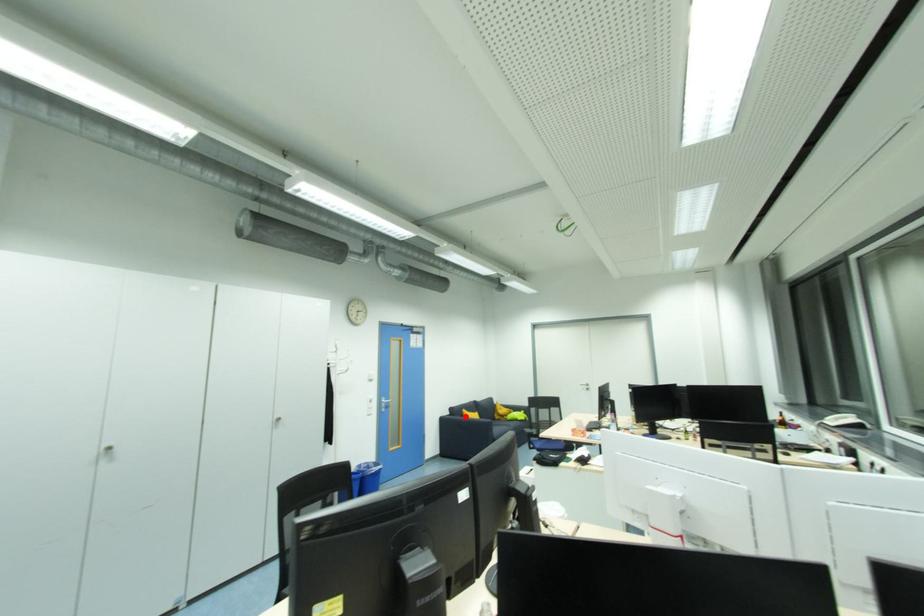
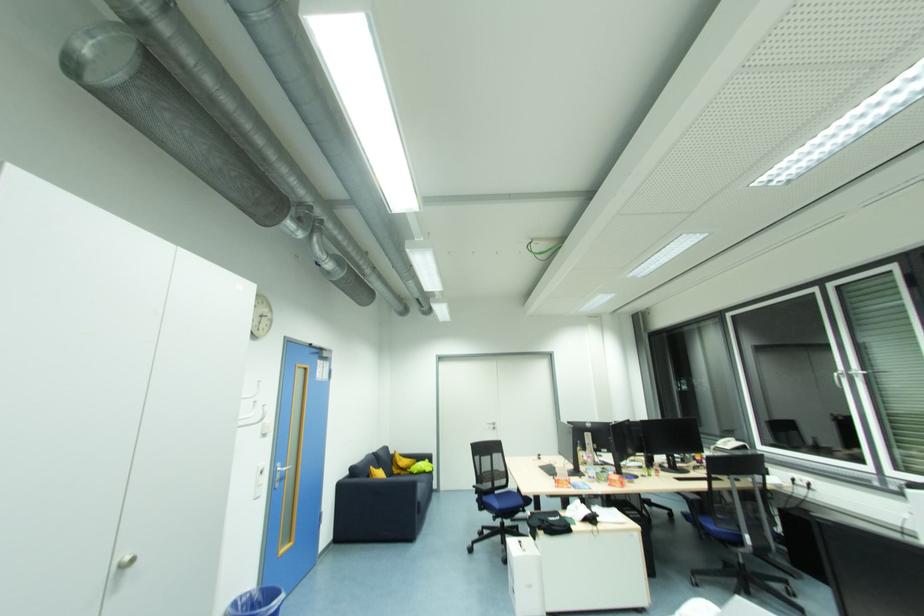
Where in the second image is the point corresponding to the highlighted location from the first image?

(371, 477)